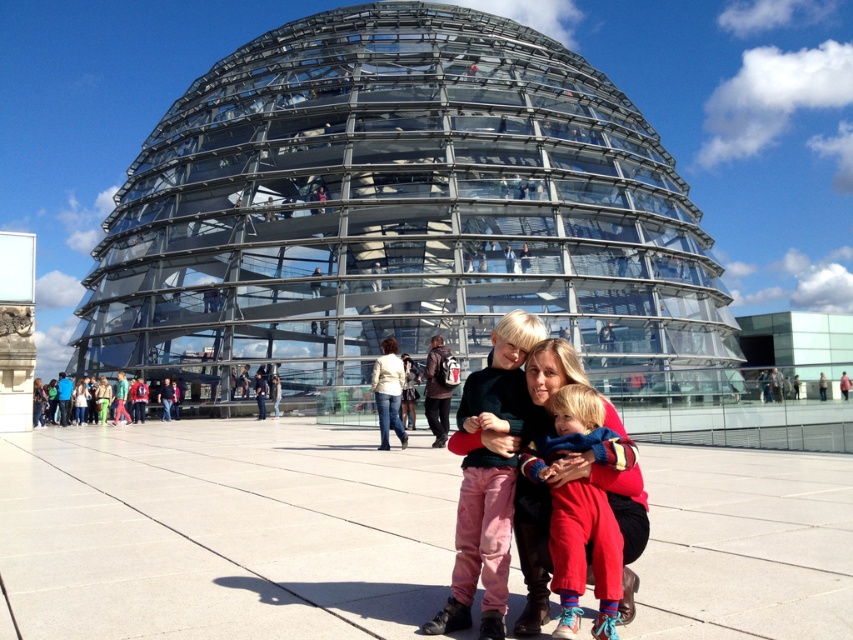
Question: Can you confirm if dark green sweater at center is positioned to the right of denim jacket at center?

Choices:
 (A) yes
 (B) no

Answer: (A)

Question: Can you confirm if knitted wool scarf at center is bigger than denim jacket at center?

Choices:
 (A) no
 (B) yes

Answer: (A)

Question: Is dark green sweater at center positioned before knitted wool scarf at center?

Choices:
 (A) no
 (B) yes

Answer: (B)

Question: Which is nearer to the dark green sweater at center?

Choices:
 (A) denim jacket at center
 (B) knitted wool scarf at center

Answer: (B)

Question: Which point is closer to the camera?

Choices:
 (A) (384, 385)
 (B) (468, 387)
 (C) (608, 563)

Answer: (C)

Question: Considering the real-world distances, which object is closest to the denim jacket at center?

Choices:
 (A) dark green sweater at center
 (B) knitted wool scarf at center

Answer: (A)